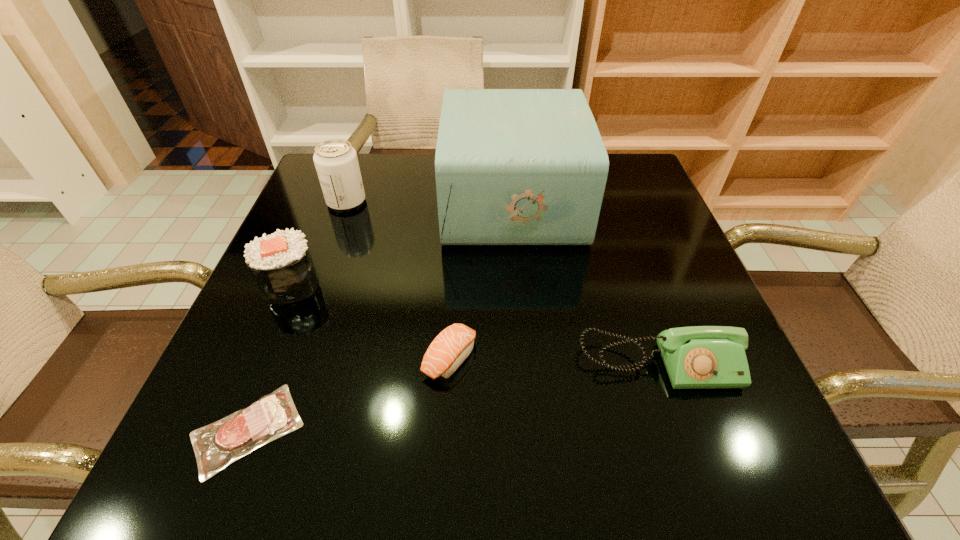
At what (x,y) coordinates should I click in order to perform the action: click on the tallest object. Please return your answer as a coordinate pair (x, y). The image size is (960, 540). Looking at the image, I should click on (513, 166).

The width and height of the screenshot is (960, 540). I want to click on the second tallest object, so click(x=336, y=162).

In order to click on the third tallest object in this screenshot , I will do `click(281, 264)`.

The width and height of the screenshot is (960, 540). Find the location of `the third farthest object`. the third farthest object is located at coordinates (281, 264).

The width and height of the screenshot is (960, 540). In order to click on telephone in this screenshot , I will do `click(699, 357)`.

The height and width of the screenshot is (540, 960). Identify the location of the second shortest object. [453, 345].

Where is `the right sushi`? This screenshot has width=960, height=540. the right sushi is located at coordinates (453, 345).

In order to click on steak in this screenshot , I will do `click(217, 445)`.

Where is `blank space located on the front panel of the tallest object`? blank space located on the front panel of the tallest object is located at coordinates (387, 201).

The image size is (960, 540). What are the coordinates of `blank area located on the front panel of the tallest object` in the screenshot? It's located at (367, 201).